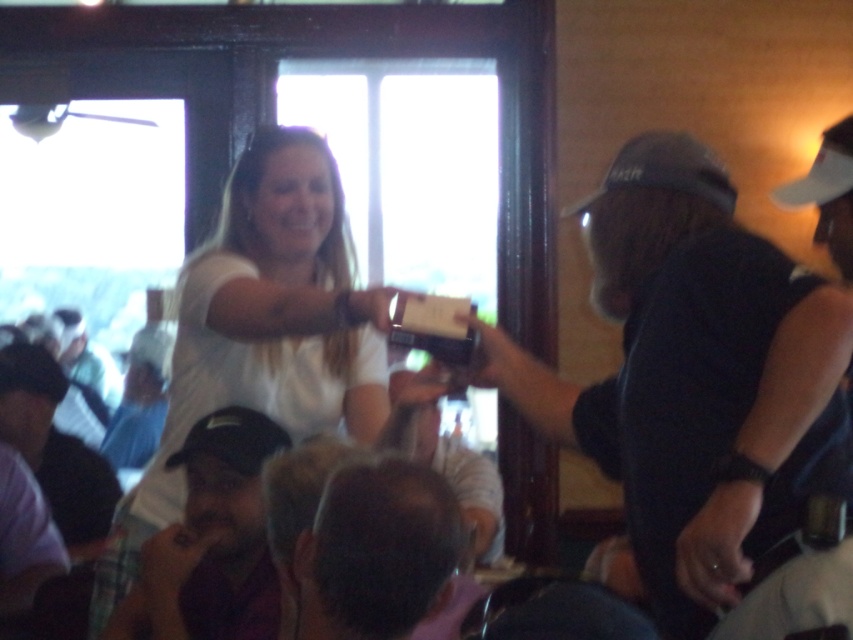
You are at a social event and notice two hats in the scene. The dark brown leather cap at lower left and the white fabric baseball cap at upper right. Which one is bigger?

The dark brown leather cap at lower left is larger in size than the white fabric baseball cap at upper right.

You are organizing a gift exchange event and need to ensure that the gifts fit on the table. The table has a width of 40 cm. You have two items to place there. The first item is the dark gray cap at center, and the second is the dark brown hair at lower center. Can both items fit side by side on the table?

The dark gray cap at center is wider than the dark brown hair at lower center. Since the table is only 40 cm wide, we need to know their exact widths to determine if they can fit together. However, the description only states the cap is wider, not the exact measurements. Without specific dimensions, we can only assume that if the combined width of both items is less than or equal to 40 cm, they might fit. But since the cap is larger, it might take up more space, potentially making it difficult to fit both.

You are standing in the room and want to determine which of the two points, point 1 at coordinates point 1 at coordinates point [132,621] or point 2 at coordinates point [801,186], is closer to you. Based on the scene description, which point is nearer?

Point 1 at coordinates point [132,621] is closer to you than point 2 at coordinates point [801,186].